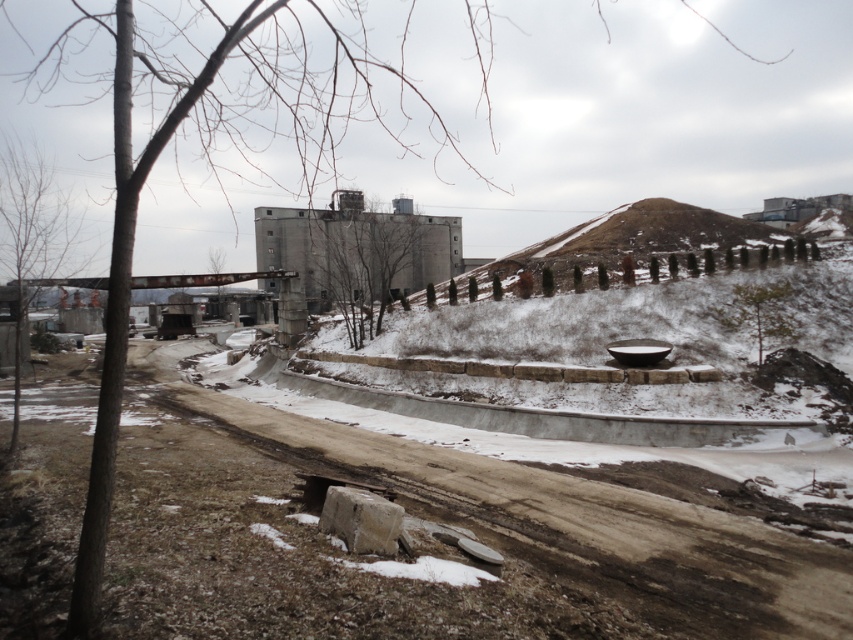
Question: Is brown dirt track at center below bare wood tree at left?

Choices:
 (A) no
 (B) yes

Answer: (B)

Question: Which object is farther from the camera taking this photo?

Choices:
 (A) brown dirt track at center
 (B) bare wood tree at left

Answer: (B)

Question: Is bare branches at center below bare wood tree at left?

Choices:
 (A) yes
 (B) no

Answer: (A)

Question: Which point appears farthest from the camera in this image?

Choices:
 (A) (329, 225)
 (B) (0, 248)
 (C) (585, 547)

Answer: (A)

Question: Which object is positioned farthest from the brown dirt track at center?

Choices:
 (A) bare branches at center
 (B) bare wood tree at left

Answer: (B)

Question: Can you confirm if brown dirt track at center is bigger than bare branches at center?

Choices:
 (A) no
 (B) yes

Answer: (A)